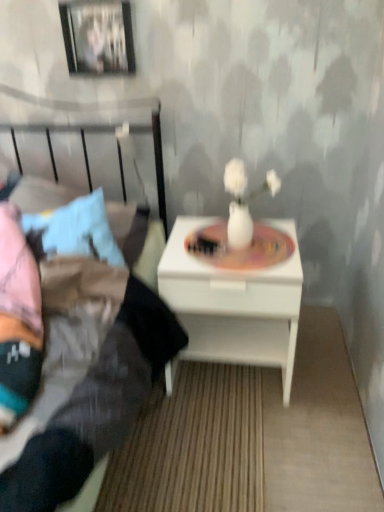
Question: From the image's perspective, is metallic silver picture frame at upper left above white glossy nightstand at center?

Choices:
 (A) yes
 (B) no

Answer: (A)

Question: Is metallic silver picture frame at upper left directly adjacent to white glossy nightstand at center?

Choices:
 (A) yes
 (B) no

Answer: (B)

Question: Considering the relative sizes of metallic silver picture frame at upper left and white glossy nightstand at center in the image provided, is metallic silver picture frame at upper left thinner than white glossy nightstand at center?

Choices:
 (A) no
 (B) yes

Answer: (B)

Question: Is metallic silver picture frame at upper left completely or partially outside of white glossy nightstand at center?

Choices:
 (A) no
 (B) yes

Answer: (B)

Question: Does metallic silver picture frame at upper left come behind white glossy nightstand at center?

Choices:
 (A) no
 (B) yes

Answer: (B)

Question: Is matte white vase at center bigger or smaller than matte black bed at left?

Choices:
 (A) small
 (B) big

Answer: (A)

Question: From the image's perspective, is matte white vase at center above or below matte black bed at left?

Choices:
 (A) above
 (B) below

Answer: (A)

Question: In terms of height, does matte white vase at center look taller or shorter compared to matte black bed at left?

Choices:
 (A) tall
 (B) short

Answer: (B)

Question: From a real-world perspective, relative to matte black bed at left, is matte white vase at center vertically above or below?

Choices:
 (A) below
 (B) above

Answer: (B)

Question: Is white glossy nightstand at center taller or shorter than matte black bed at left?

Choices:
 (A) short
 (B) tall

Answer: (A)

Question: From the image's perspective, is white glossy nightstand at center located above or below matte black bed at left?

Choices:
 (A) above
 (B) below

Answer: (B)

Question: Is point (299, 263) closer or farther from the camera than point (172, 349)?

Choices:
 (A) farther
 (B) closer

Answer: (A)

Question: Considering their positions, is white glossy nightstand at center located in front of or behind matte black bed at left?

Choices:
 (A) behind
 (B) front

Answer: (A)

Question: In the image, is matte black bed at left on the left side or the right side of white glossy nightstand at center?

Choices:
 (A) right
 (B) left

Answer: (B)

Question: From the image's perspective, relative to white glossy nightstand at center, is matte black bed at left above or below?

Choices:
 (A) below
 (B) above

Answer: (B)